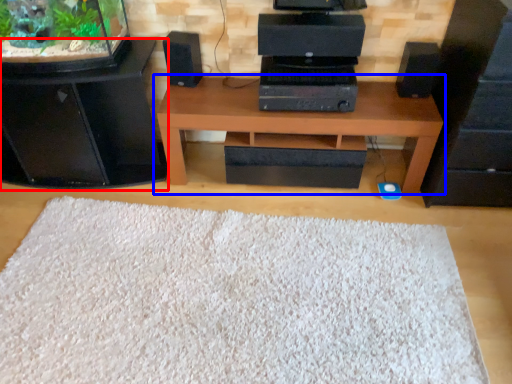
Question: Which of the following is the closest to the observer, furniture (highlighted by a red box) or table (highlighted by a blue box)?

Choices:
 (A) furniture
 (B) table

Answer: (A)